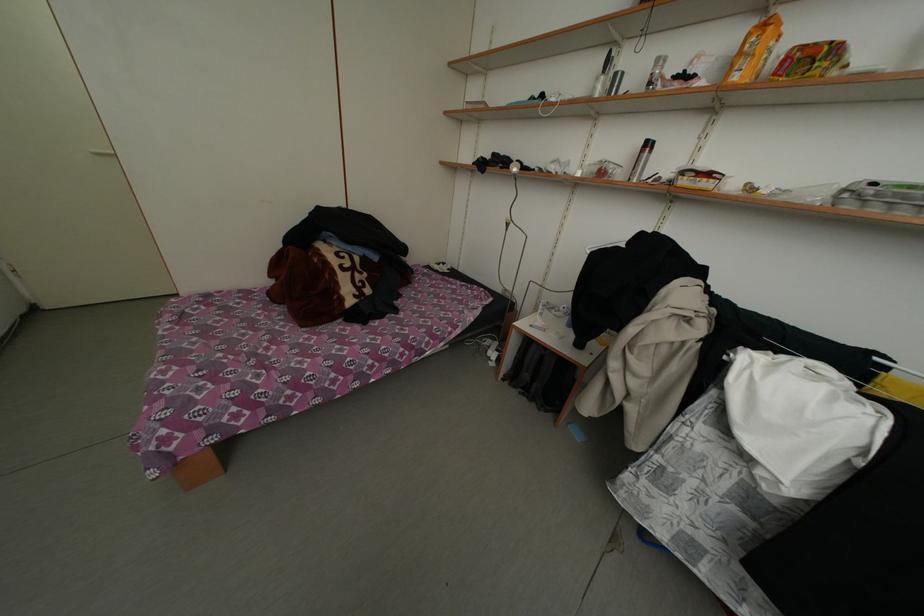
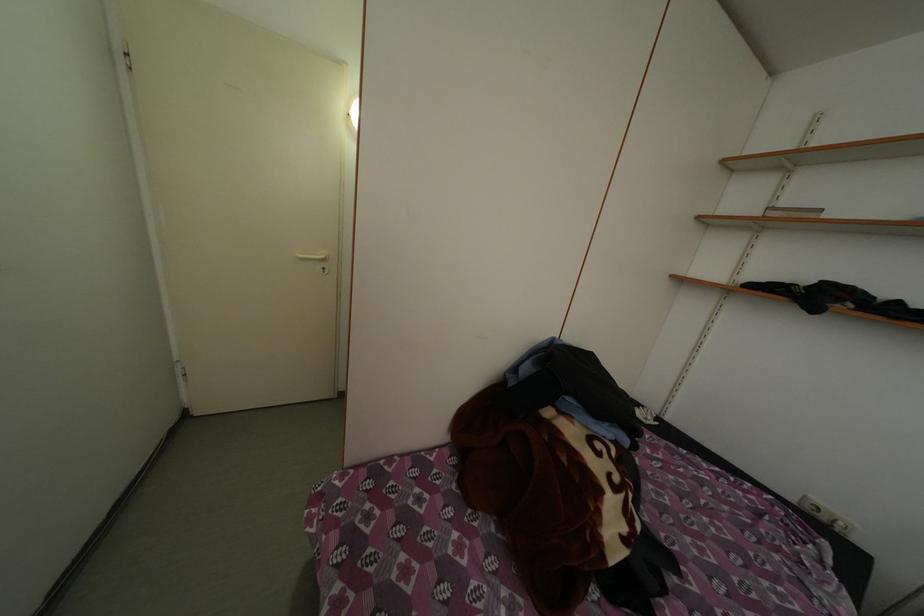
The images are taken continuously from a first-person perspective. In which direction are you moving?

The cameraman walked toward left, forward.